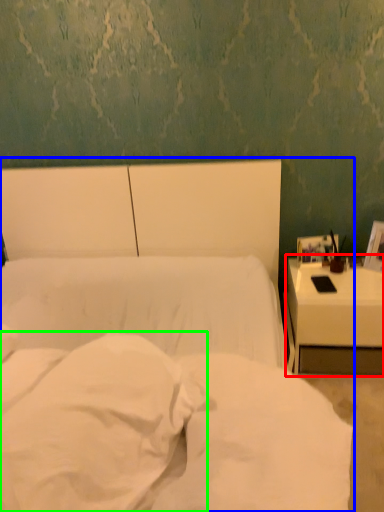
Question: Considering the real-world distances, which object is farthest from nightstand (highlighted by a red box)? bed (highlighted by a blue box) or pillow (highlighted by a green box)?

Choices:
 (A) bed
 (B) pillow

Answer: (B)